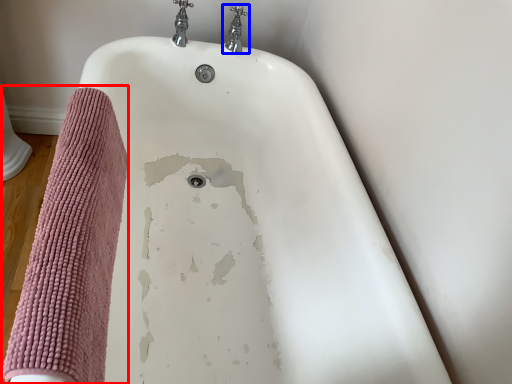
Question: Among these objects, which one is nearest to the camera, bath towel (highlighted by a red box) or tap (highlighted by a blue box)?

Choices:
 (A) bath towel
 (B) tap

Answer: (A)